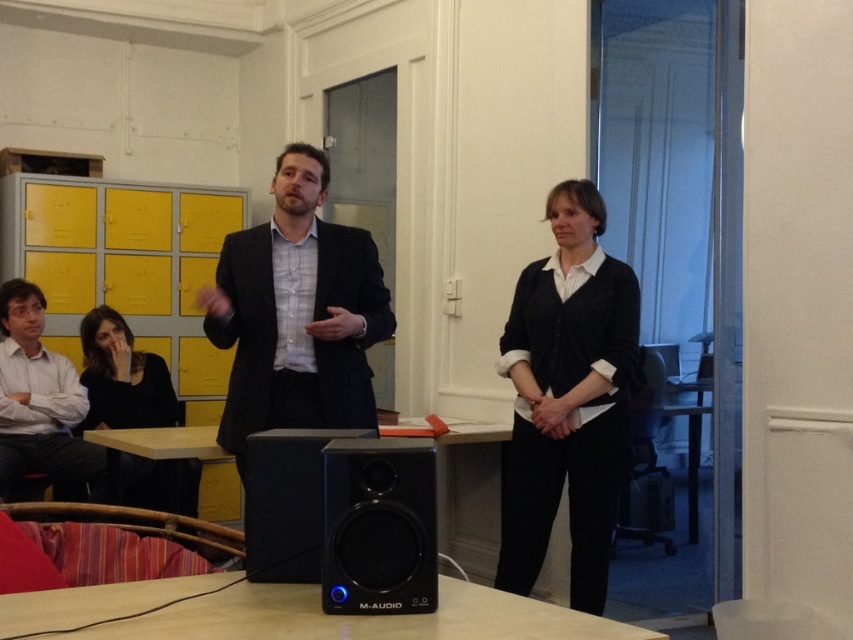
You are organizing a meeting in this room and need to place a laptop on the wooden table at center. The laptop requires a minimum of 10 inches of space from the black plastic speaker at lower center to avoid interference. Is the current distance sufficient?

The wooden table at center is 8.56 inches from the black plastic speaker at lower center. Since the required minimum distance is 10 inches, the current spacing is insufficient to prevent interference.

You are standing in the meeting room and want to take a photo of the point at coordinates [354,392]. The camera you are using has a minimum focus distance of 2.5 meters. Will the camera be able to focus on the point?

The point at coordinates [354,392] is 3.08 meters from the camera. Since the minimum focus distance is 2.5 meters, the camera can focus on the point as it is beyond the minimum required distance.

You are a person who needs to move a 1.5 meter long table through the space between the black textured suit at center and the black plastic speaker at lower center. Is there enough space to move the table horizontally between them?

The distance between the black textured suit at center and the black plastic speaker at lower center is 1.26 meters. Since the table is 1.5 meters long, it is longer than the available space, so the table cannot be moved horizontally between them.